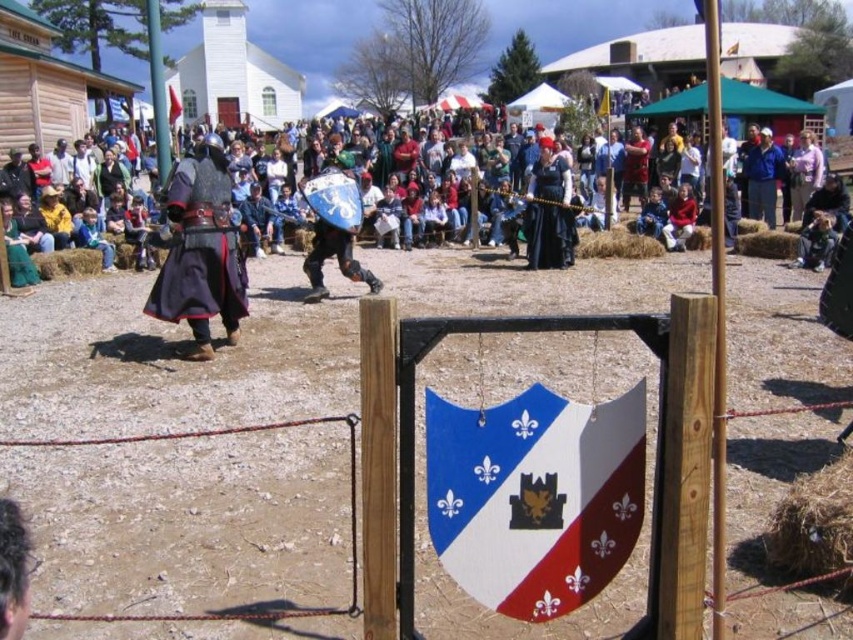
You are standing at the edge of the dirt field at center. A friend is at position point 0.694, 0.511. Where should you move to meet them?

The dirt field at center is located at position point (434, 444), so you should move towards the center of the dirt field at center to meet your friend there.

You are a spectator at the medieval event. You notice the dark clothing at center and the red fabric flag at upper center. Which object is closer to you?

The dark clothing at center is closer to you because it is in front of the red fabric flag at upper center.